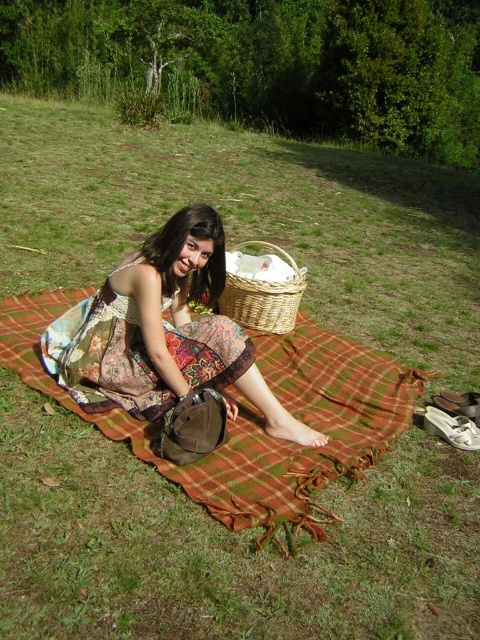
Is point (22, 340) positioned in front of point (228, 378)?

No, it is behind (228, 378).

Which is below, plaid woolen blanket at center or printed fabric dress at center?

plaid woolen blanket at center

What do you see at coordinates (254, 417) in the screenshot? I see `plaid woolen blanket at center` at bounding box center [254, 417].

This screenshot has width=480, height=640. What are the coordinates of `plaid woolen blanket at center` in the screenshot? It's located at (254, 417).

Between point (382, 384) and point (294, 276), which one is positioned behind?

Point (294, 276)

Does plaid woolen blanket at center have a larger size compared to woven natural basket at center?

Yes.

Locate an element on the screen. This screenshot has width=480, height=640. plaid woolen blanket at center is located at coordinates (254, 417).

Describe the element at coordinates (163, 332) in the screenshot. I see `printed fabric dress at center` at that location.

Between printed fabric dress at center and woven natural basket at center, which one appears on the right side from the viewer's perspective?

woven natural basket at center is more to the right.

Is point (96, 408) positioned in front of point (236, 291)?

Yes, it is in front of point (236, 291).

Find the location of a particular element. printed fabric dress at center is located at coordinates (163, 332).